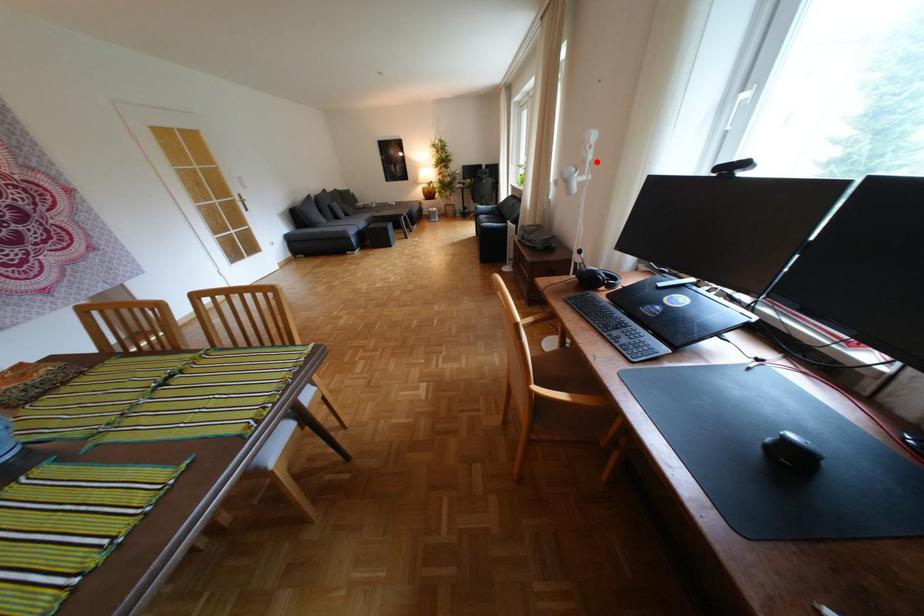
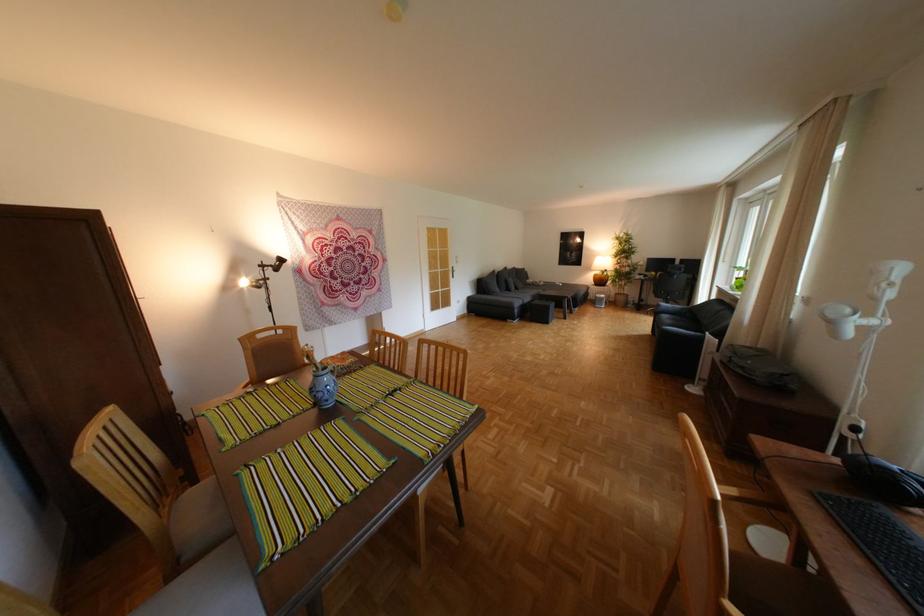
Question: I am providing you with two images of the same scene from different viewpoints. In image1, a red point is highlighted. Considering the same 3D point in image2, which of the following is correct?

Choices:
 (A) It is closer
 (B) It is farther

Answer: (B)